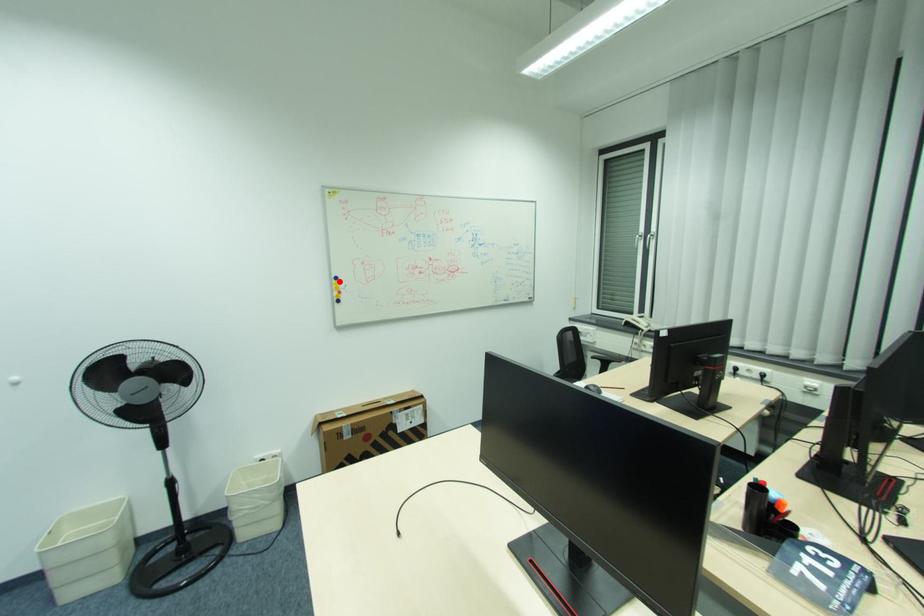
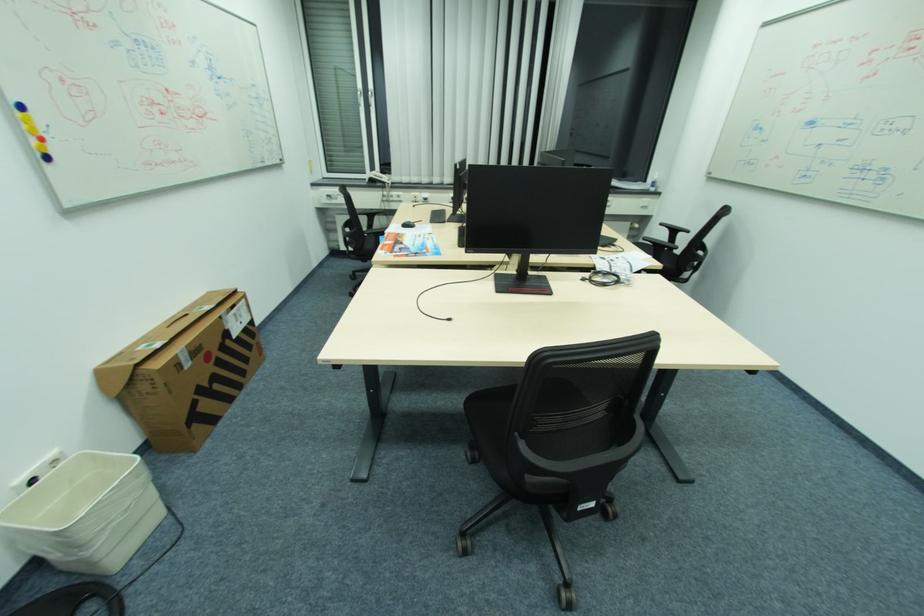
Locate, in the second image, the point that corresponds to the highlighted location in the first image.

(21, 114)